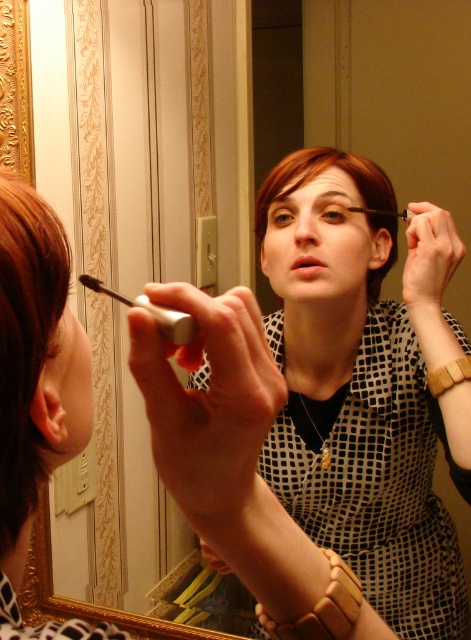
Question: Based on their relative distances, which object is nearer to the brown matte eyebrow at upper center?

Choices:
 (A) black matte eyeliner at upper center
 (B) black matte eyeliner at center
 (C) brown matte hair at left
 (D) matte black lipstick at center

Answer: (B)

Question: Can you confirm if brown matte hair at left is positioned above brown matte eyebrow at upper center?

Choices:
 (A) yes
 (B) no

Answer: (B)

Question: Which point is closer to the camera?

Choices:
 (A) tap(267, 186)
 (B) tap(318, 195)
 (C) tap(132, 300)

Answer: (C)

Question: Does brown matte hair at center lie in front of brown matte eyebrow at upper center?

Choices:
 (A) yes
 (B) no

Answer: (A)

Question: Does brown matte hair at center have a lesser width compared to matte black lipstick at center?

Choices:
 (A) no
 (B) yes

Answer: (A)

Question: Which point is closer to the camera taking this photo?

Choices:
 (A) (316, 257)
 (B) (46, 470)
 (C) (347, 192)

Answer: (B)